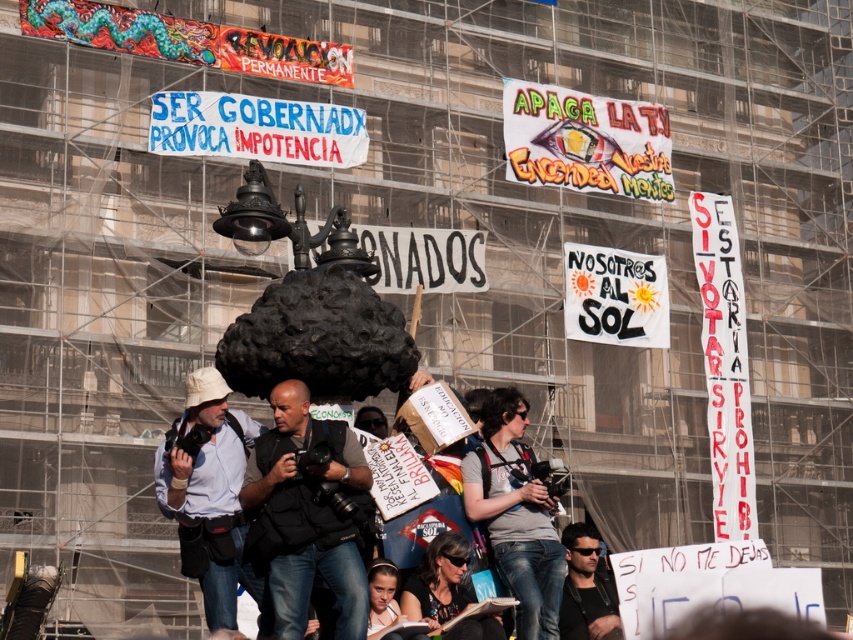
Question: Where is dark gray vest at center located in relation to white matte shirt at lower left in the image?

Choices:
 (A) below
 (B) above

Answer: (B)

Question: Is dark gray vest at center in front of white matte shirt at lower left?

Choices:
 (A) yes
 (B) no

Answer: (A)

Question: Based on their relative distances, which object is farther from the dark gray vest at center?

Choices:
 (A) dark hair at center
 (B) white matte shirt at lower left

Answer: (A)

Question: Is white matte shirt at lower left to the left of dark hair at center from the viewer's perspective?

Choices:
 (A) no
 (B) yes

Answer: (B)

Question: Which point is closer to the camera?

Choices:
 (A) (329, 536)
 (B) (204, 595)
 (C) (611, 624)

Answer: (A)

Question: Which is nearer to the dark gray vest at center?

Choices:
 (A) white matte shirt at lower left
 (B) dark hair at center

Answer: (A)